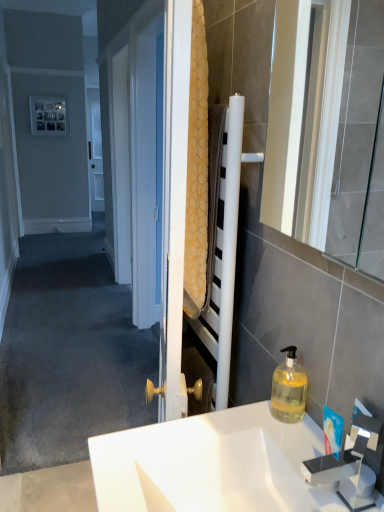
Question: Visually, is metallic silver picture frame at upper left positioned to the left or to the right of translucent plastic faucet at upper right?

Choices:
 (A) right
 (B) left

Answer: (B)

Question: In terms of height, does metallic silver picture frame at upper left look taller or shorter compared to translucent plastic faucet at upper right?

Choices:
 (A) tall
 (B) short

Answer: (A)

Question: Which of these objects is positioned farthest from the white glossy mirror at right?

Choices:
 (A) translucent plastic faucet at upper right
 (B) metallic silver picture frame at upper left
 (C) translucent yellow liquid at lower right
 (D) yellow textured towel at center
 (E) white glossy sink at center

Answer: (B)

Question: Which of these objects is positioned closest to the translucent yellow liquid at lower right?

Choices:
 (A) white glossy mirror at right
 (B) translucent plastic faucet at upper right
 (C) white glossy sink at center
 (D) metallic silver picture frame at upper left
 (E) yellow textured towel at center

Answer: (B)